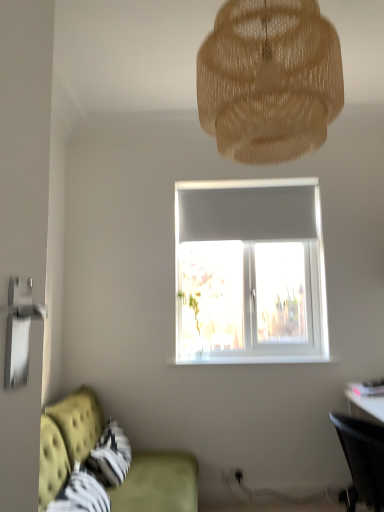
The width and height of the screenshot is (384, 512). What do you see at coordinates (362, 459) in the screenshot?
I see `black mesh chair at lower right` at bounding box center [362, 459].

Identify the location of translucent beige mesh at upper center. (269, 80).

Where is `velvet green couch at lower left`? The width and height of the screenshot is (384, 512). velvet green couch at lower left is located at coordinates (67, 438).

Which point is more distant from viewer, [64,415] or [376,430]?

The point [64,415] is farther.

Considering the sizes of objects velvet green couch at lower left and black mesh chair at lower right in the image provided, who is wider, velvet green couch at lower left or black mesh chair at lower right?

With larger width is velvet green couch at lower left.

In the scene shown: Is velvet green couch at lower left outside of black mesh chair at lower right?

Yes, velvet green couch at lower left is not within black mesh chair at lower right.

Measure the distance from velvet green couch at lower left to black mesh chair at lower right.

velvet green couch at lower left is 4.63 feet from black mesh chair at lower right.

Is point (372, 478) positioned before point (186, 488)?

Yes, it is.

Is black mesh chair at lower right shorter than velvet green couch at lower left?

Yes, black mesh chair at lower right is shorter than velvet green couch at lower left.

Considering the relative positions of black mesh chair at lower right and velvet green couch at lower left in the image provided, is black mesh chair at lower right to the right of velvet green couch at lower left from the viewer's perspective?

Indeed, black mesh chair at lower right is positioned on the right side of velvet green couch at lower left.

Is black mesh chair at lower right wider than velvet green couch at lower left?

In fact, black mesh chair at lower right might be narrower than velvet green couch at lower left.

Is translucent beige mesh at upper center thinner than black mesh chair at lower right?

No.

Is translucent beige mesh at upper center positioned with its back to black mesh chair at lower right?

translucent beige mesh at upper center does not have its back to black mesh chair at lower right.

In terms of size, does translucent beige mesh at upper center appear bigger or smaller than black mesh chair at lower right?

Considering their sizes, translucent beige mesh at upper center takes up more space than black mesh chair at lower right.

Is translucent beige mesh at upper center beside black mesh chair at lower right?

translucent beige mesh at upper center is not next to black mesh chair at lower right, and they're not touching.

Between black mesh chair at lower right and translucent beige mesh at upper center, which one has larger width?

Wider between the two is translucent beige mesh at upper center.

Considering the positions of point (348, 425) and point (201, 124), is point (348, 425) closer or farther from the camera than point (201, 124)?

Point (348, 425) appears to be farther away from the viewer than point (201, 124).

Can you confirm if black mesh chair at lower right is positioned to the left of translucent beige mesh at upper center?

No, black mesh chair at lower right is not to the left of translucent beige mesh at upper center.

Is black mesh chair at lower right not near translucent beige mesh at upper center?

black mesh chair at lower right is far away from translucent beige mesh at upper center.

Is translucent beige mesh at upper center surrounding velvet green couch at lower left?

No.

From the image's perspective, which is below, translucent beige mesh at upper center or velvet green couch at lower left?

From the image's view, velvet green couch at lower left is below.

Which point is more distant from viewer, (310, 50) or (73, 421)?

Positioned behind is point (73, 421).

From their relative heights in the image, would you say translucent beige mesh at upper center is taller or shorter than velvet green couch at lower left?

In the image, translucent beige mesh at upper center appears to be shorter than velvet green couch at lower left.

Which is behind, point (76, 451) or point (253, 93)?

Positioned behind is point (76, 451).

Locate an element on the screen. studio couch below the translucent beige mesh at upper center (from the image's perspective) is located at coordinates (67, 438).

Are velvet green couch at lower left and translucent beige mesh at upper center making contact?

No, velvet green couch at lower left is not with translucent beige mesh at upper center.

Is velvet green couch at lower left positioned with its back to translucent beige mesh at upper center?

velvet green couch at lower left does not have its back to translucent beige mesh at upper center.

The image size is (384, 512). What are the coordinates of `chair lying on the right of velvet green couch at lower left` in the screenshot? It's located at (362, 459).

Find the location of a particular element. studio couch in front of the black mesh chair at lower right is located at coordinates (67, 438).

When comparing their distances from translucent beige mesh at upper center, does velvet green couch at lower left or black mesh chair at lower right seem closer?

black mesh chair at lower right.

When comparing their distances from translucent beige mesh at upper center, does black mesh chair at lower right or velvet green couch at lower left seem closer?

black mesh chair at lower right lies closer to translucent beige mesh at upper center than the other object.

When comparing their distances from black mesh chair at lower right, does velvet green couch at lower left or translucent beige mesh at upper center seem closer?

Answer: velvet green couch at lower left is closer to black mesh chair at lower right.

Based on their spatial positions, is black mesh chair at lower right or translucent beige mesh at upper center further from velvet green couch at lower left?

translucent beige mesh at upper center.

Which object lies nearer to the anchor point velvet green couch at lower left, translucent beige mesh at upper center or black mesh chair at lower right?

black mesh chair at lower right is positioned closer to the anchor velvet green couch at lower left.

From the image, which object appears to be farther from black mesh chair at lower right, translucent beige mesh at upper center or velvet green couch at lower left?

The object further to black mesh chair at lower right is translucent beige mesh at upper center.

Locate an element on the screen. The width and height of the screenshot is (384, 512). chair between translucent beige mesh at upper center and velvet green couch at lower left from top to bottom is located at coordinates (362, 459).